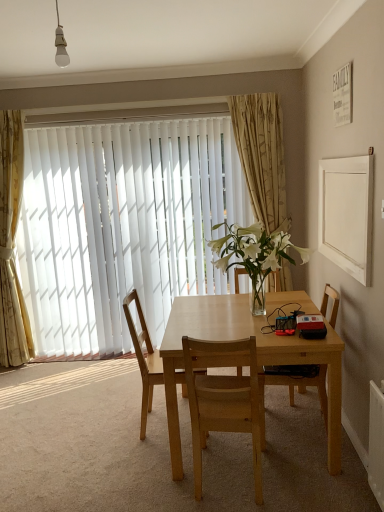
Where is `vacant area that is in front of gold textured curtain at left, the 2th curtain in the right-to-left sequence`? vacant area that is in front of gold textured curtain at left, the 2th curtain in the right-to-left sequence is located at coordinates (28, 374).